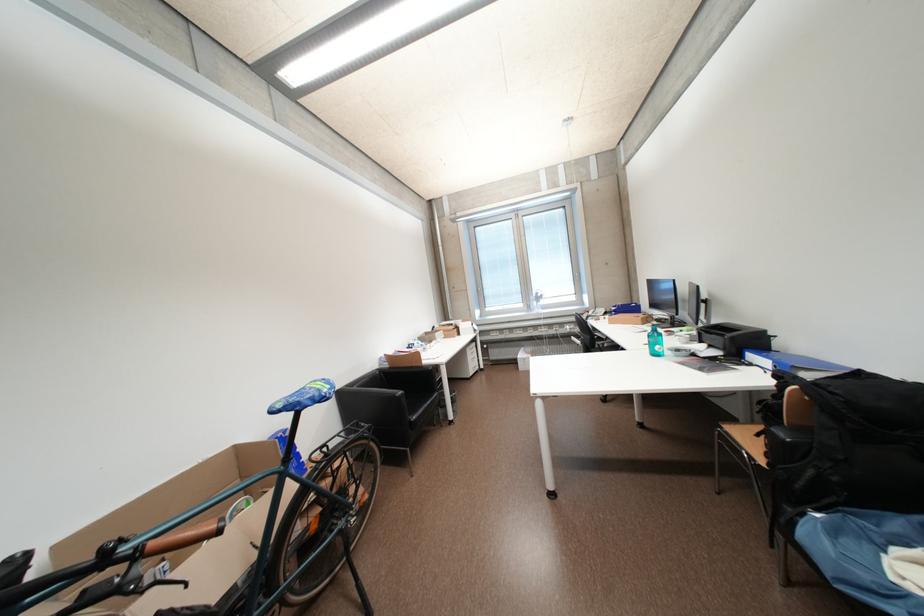
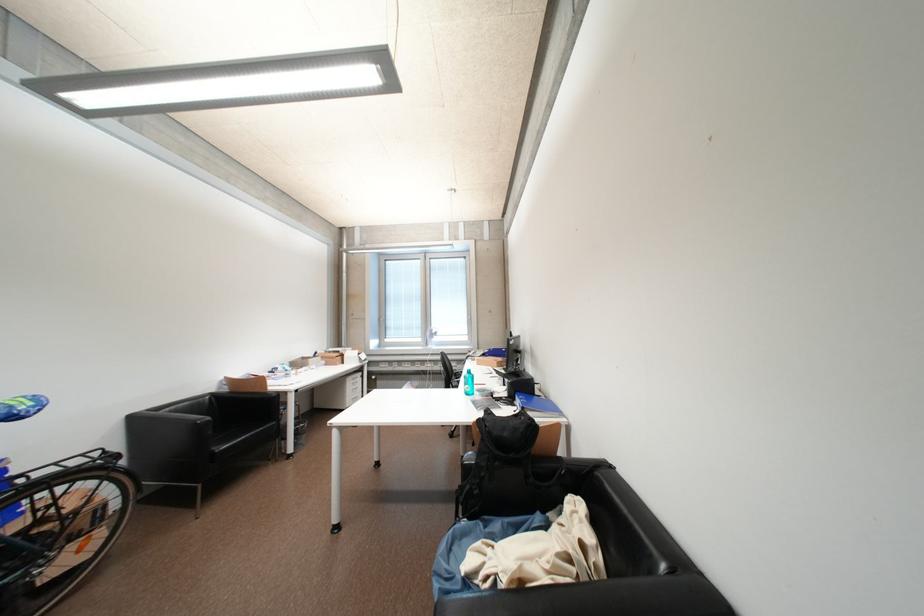
Locate, in the second image, the point that corresponds to (x=457, y=333) in the first image.

(341, 360)